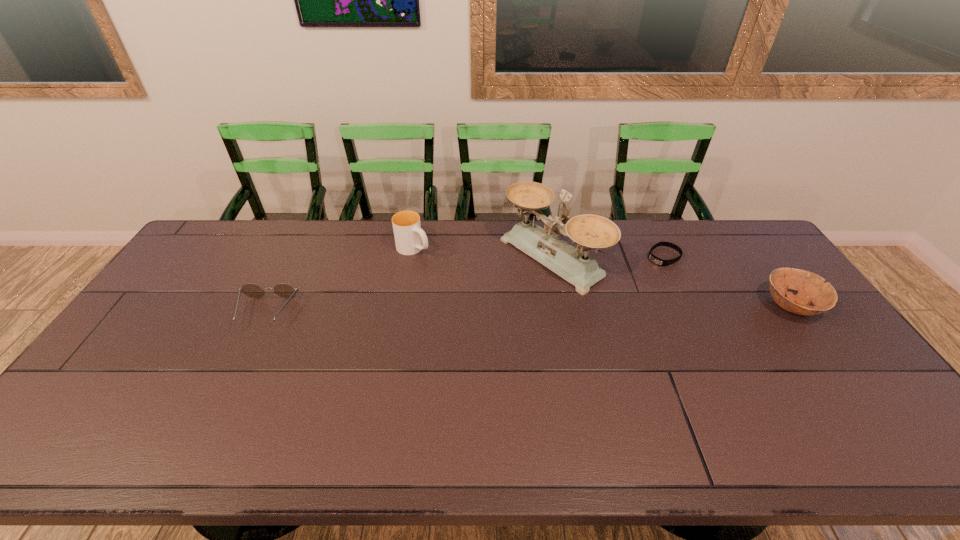
Find the location of a particular element. vacant space situated 0.220m on the front-facing side of the scale is located at coordinates (463, 315).

You are a GUI agent. You are given a task and a screenshot of the screen. Output one action in this format:
    pyautogui.click(x=<x>, y=<y>)
    Task: Click on the wristband that is positioned at the far edge
    
    Given the screenshot: What is the action you would take?
    pyautogui.click(x=653, y=258)

Identify the location of cup at the far edge. The width and height of the screenshot is (960, 540). pos(410,239).

This screenshot has height=540, width=960. I want to click on scale that is at the far edge, so click(587, 231).

Where is `object that is at the right edge`? The image size is (960, 540). object that is at the right edge is located at coordinates (811, 288).

Image resolution: width=960 pixels, height=540 pixels. In the image, there is a desktop. Identify the location of free space at the far edge. (522, 259).

What are the coordinates of `free location at the left edge` in the screenshot? It's located at (187, 278).

This screenshot has width=960, height=540. In order to click on vacant area at the right edge in this screenshot , I will do (825, 324).

Where is `blank space at the far left corner of the desktop`? This screenshot has width=960, height=540. blank space at the far left corner of the desktop is located at coordinates (233, 238).

Where is `vacant space at the near left corner of the desktop`? vacant space at the near left corner of the desktop is located at coordinates (84, 409).